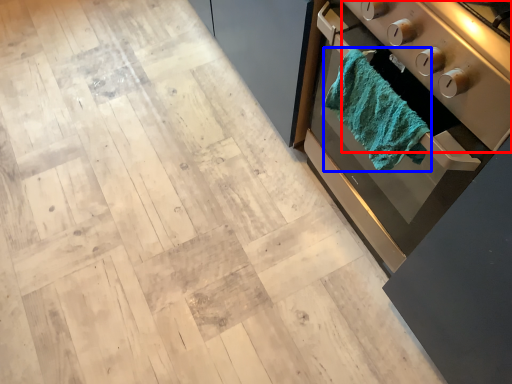
Question: Which object is further to the camera taking this photo, appliance (highlighted by a red box) or bath towel (highlighted by a blue box)?

Choices:
 (A) appliance
 (B) bath towel

Answer: (B)